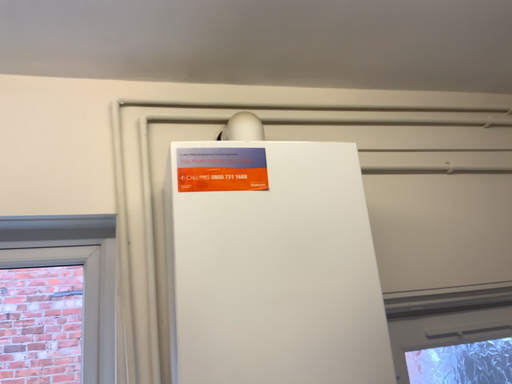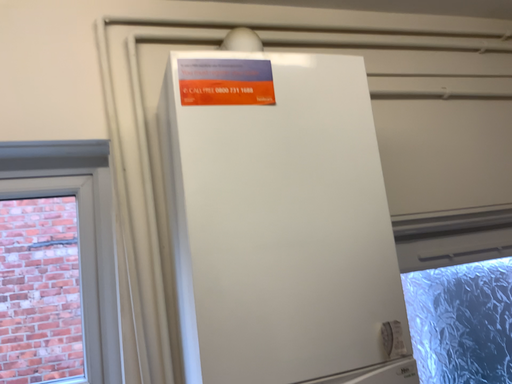
Question: How did the camera likely rotate when shooting the video?

Choices:
 (A) rotated upward
 (B) rotated downward

Answer: (B)